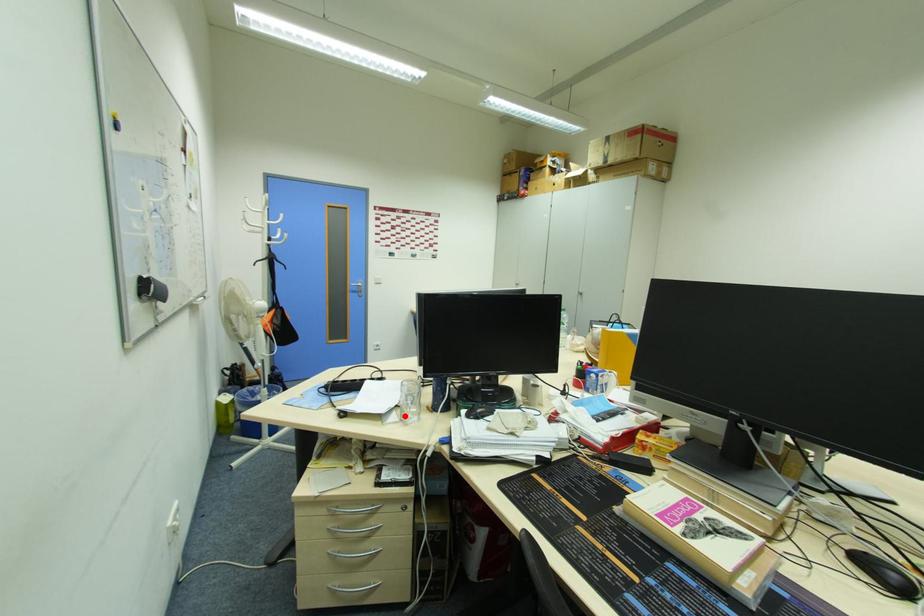
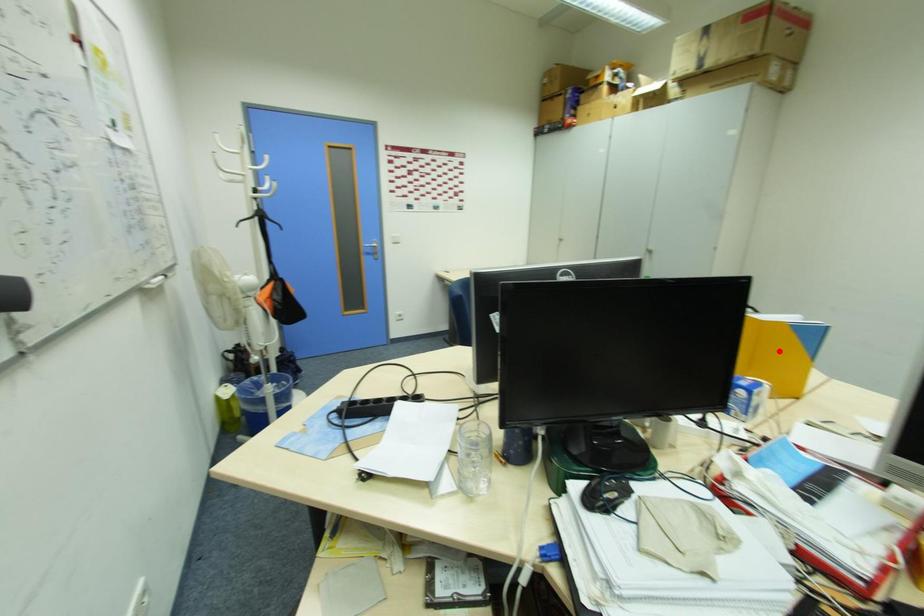
I am providing you with two images of the same scene from different viewpoints. A red point is marked on the first image and another point is marked on the second image. Does the point marked in image1 correspond to the same location as the one in image2?

No